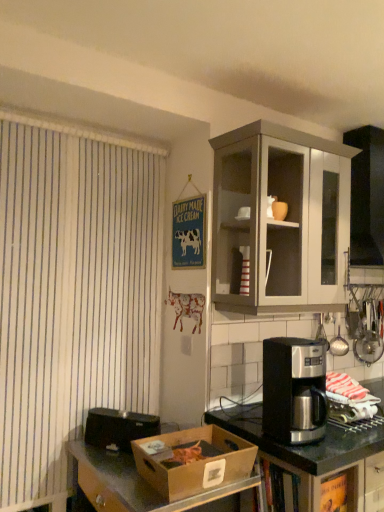
Question: Is stainless steel coffee maker at right wider or thinner than matte gray cabinet at upper right?

Choices:
 (A) wide
 (B) thin

Answer: (A)

Question: Visually, is stainless steel coffee maker at right positioned to the left or to the right of matte gray cabinet at upper right?

Choices:
 (A) right
 (B) left

Answer: (A)

Question: Which object is positioned farthest from the stainless steel coffee maker at right?

Choices:
 (A) matte gray cabinet at upper right
 (B) matte ceramic cup at upper center
 (C) black plastic toaster at lower left, the first appliance in the front-to-back sequence
 (D) metallic silver cooking utensils at right, the 1th appliance in the top-to-bottom sequence
 (E) brown cardboard box at lower left

Answer: (B)

Question: Estimate the real-world distances between objects in this image. Which object is closer to the stainless steel coffee maker at right?

Choices:
 (A) black plastic toaster at lower left, marked as the second appliance in a top-to-bottom arrangement
 (B) metallic silver coffee maker at right
 (C) matte gray cabinet at upper right
 (D) brown cardboard box at lower left
 (E) matte ceramic cup at upper center

Answer: (B)